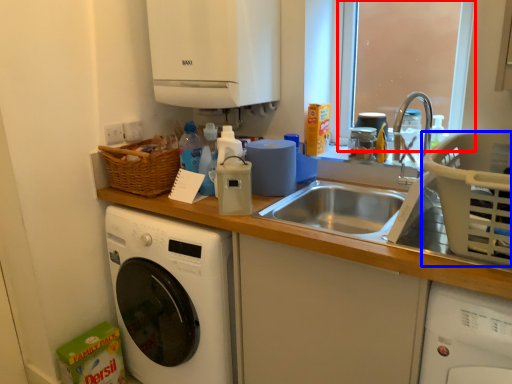
Question: Which point is further to the camera, window screen (highlighted by a red box) or basket (highlighted by a blue box)?

Choices:
 (A) window screen
 (B) basket

Answer: (A)